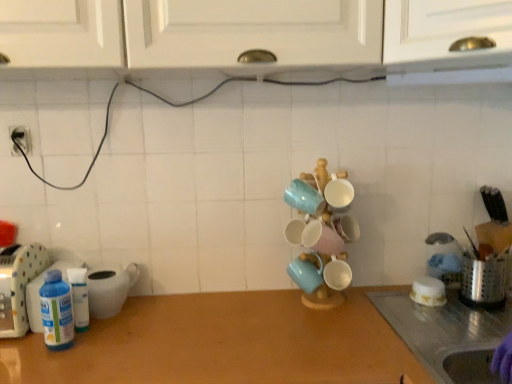
Where is `vacant space in front of matte ceramic mugs at center, the second tableware viewed from the right`? vacant space in front of matte ceramic mugs at center, the second tableware viewed from the right is located at coordinates (329, 334).